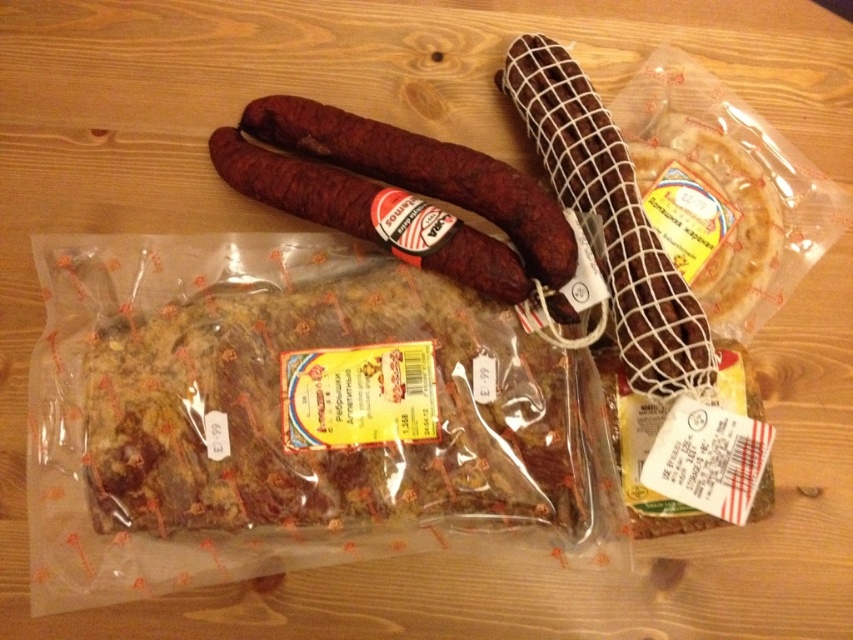
Question: Which point appears farthest from the camera in this image?

Choices:
 (A) [x=584, y=198]
 (B) [x=432, y=259]

Answer: (A)

Question: Is the position of dark brown netted sausage at upper right less distant than that of dark red textured sausage at center?

Choices:
 (A) yes
 (B) no

Answer: (A)

Question: Among these points, which one is farthest from the camera?

Choices:
 (A) (509, 64)
 (B) (508, 257)

Answer: (A)

Question: Can you confirm if dark brown netted sausage at upper right is positioned above dark red textured sausage at center?

Choices:
 (A) yes
 (B) no

Answer: (B)

Question: Is dark brown netted sausage at upper right closer to the viewer compared to dark red textured sausage at center?

Choices:
 (A) yes
 (B) no

Answer: (A)